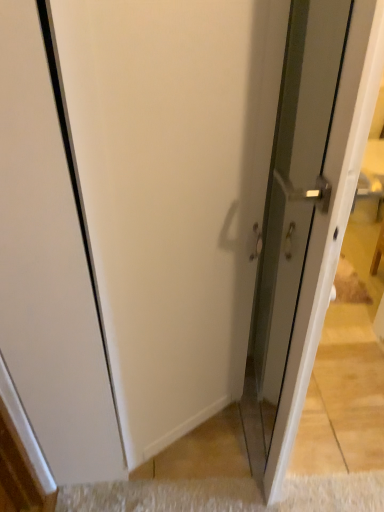
Question: Is clear glass door at right surrounding white carpet at lower center?

Choices:
 (A) no
 (B) yes

Answer: (A)

Question: Are clear glass door at right and white carpet at lower center located far from each other?

Choices:
 (A) yes
 (B) no

Answer: (B)

Question: Can you confirm if clear glass door at right is taller than white carpet at lower center?

Choices:
 (A) no
 (B) yes

Answer: (B)

Question: Is clear glass door at right further to the viewer compared to white carpet at lower center?

Choices:
 (A) no
 (B) yes

Answer: (A)

Question: From a real-world perspective, is clear glass door at right beneath white carpet at lower center?

Choices:
 (A) no
 (B) yes

Answer: (A)

Question: Is clear glass door at right smaller than white carpet at lower center?

Choices:
 (A) yes
 (B) no

Answer: (B)

Question: Does white carpet at lower center have a lesser width compared to clear glass door at right?

Choices:
 (A) yes
 (B) no

Answer: (A)

Question: Does white carpet at lower center have a greater width compared to clear glass door at right?

Choices:
 (A) yes
 (B) no

Answer: (B)

Question: From the image's perspective, is white carpet at lower center below clear glass door at right?

Choices:
 (A) yes
 (B) no

Answer: (A)

Question: Considering the relative positions of white carpet at lower center and clear glass door at right in the image provided, is white carpet at lower center to the right of clear glass door at right from the viewer's perspective?

Choices:
 (A) no
 (B) yes

Answer: (A)

Question: Can you confirm if white carpet at lower center is bigger than clear glass door at right?

Choices:
 (A) no
 (B) yes

Answer: (A)

Question: Is clear glass door at right a part of white carpet at lower center?

Choices:
 (A) yes
 (B) no

Answer: (B)

Question: From their relative heights in the image, would you say white carpet at lower center is taller or shorter than clear glass door at right?

Choices:
 (A) short
 (B) tall

Answer: (A)